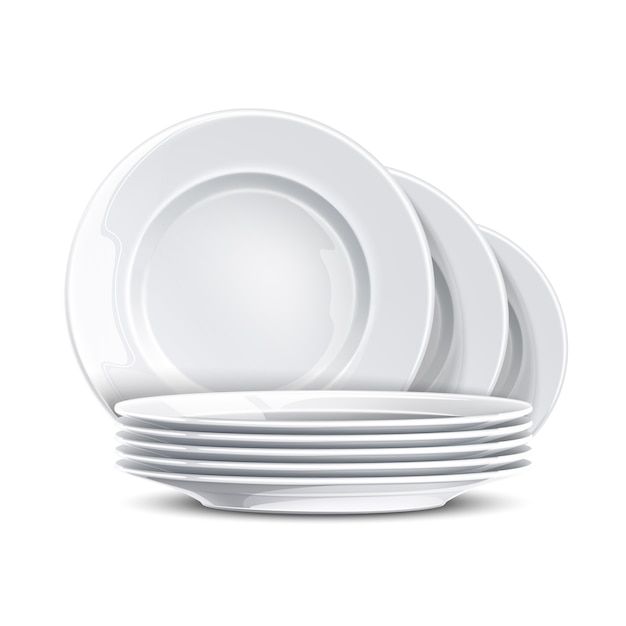
This screenshot has width=626, height=626. Find the location of `plates`. plates is located at coordinates (342, 426), (337, 439), (327, 454), (320, 471), (317, 485), (332, 332), (459, 319), (516, 332).